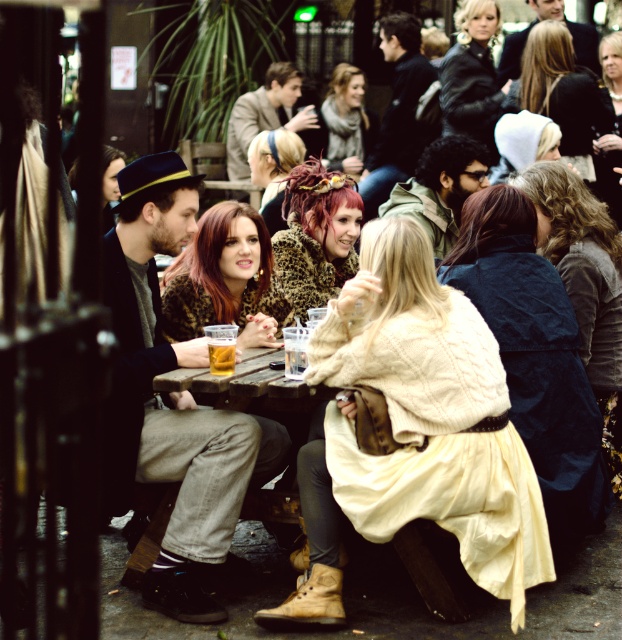
Please look at the image. There is a point marked at coordinates (345, 120). What object or feature in the scene is located at this point?

The point at coordinates (345, 120) marks the location of the blonde hair at center.

You are a waiter at the outdoor patio and need to place a new order of a 12cm wide plate on the table. Can the wooden table at center accommodate the plate without overlapping the translucent glass cup at center?

The wooden table at center is wider than the translucent glass cup at center, so the plate should fit without overlapping the cup as long as it is placed appropriately.